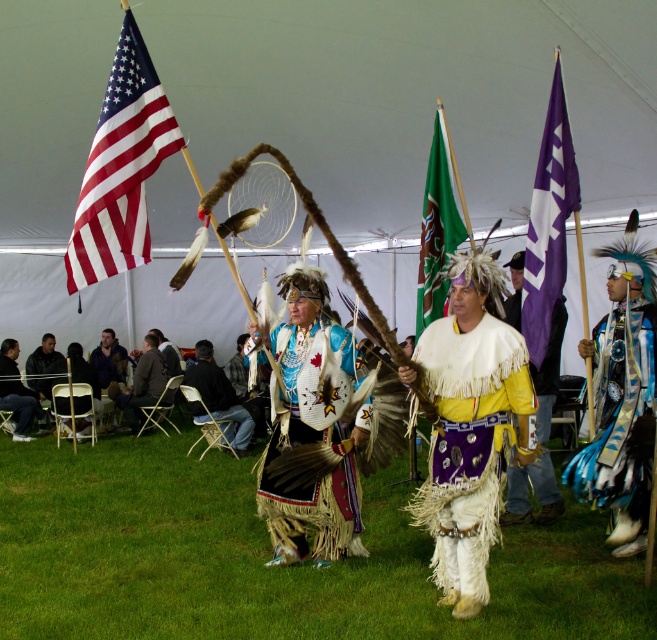
Can you confirm if blue feathered headdress at right is positioned to the right of purple fabric flag at right?

Indeed, blue feathered headdress at right is positioned on the right side of purple fabric flag at right.

Does blue feathered headdress at right appear under purple fabric flag at right?

Indeed, blue feathered headdress at right is positioned under purple fabric flag at right.

Which is behind, point (643, 298) or point (555, 211)?

Point (555, 211)

I want to click on blue feathered headdress at right, so click(620, 419).

In the scene shown: Between beige fringed skirt at center and denim jacket at lower left, which one is positioned lower?

beige fringed skirt at center is below.

Between point (307, 506) and point (16, 417), which one is positioned in front?

Positioned in front is point (307, 506).

Between point (265, 490) and point (24, 420), which one is positioned behind?

The point (24, 420) is more distant.

Find the location of a particular element. This screenshot has width=657, height=640. beige fringed skirt at center is located at coordinates (307, 442).

Does point (104, 122) come closer to viewer compared to point (541, 182)?

Yes, point (104, 122) is in front of point (541, 182).

Can you confirm if red-white striped flag at upper left is positioned to the left of purple fabric flag at right?

Indeed, red-white striped flag at upper left is positioned on the left side of purple fabric flag at right.

Between point (74, 284) and point (530, 332), which one is positioned behind?

Point (530, 332)

Identify the location of red-white striped flag at upper left. This screenshot has width=657, height=640. (120, 166).